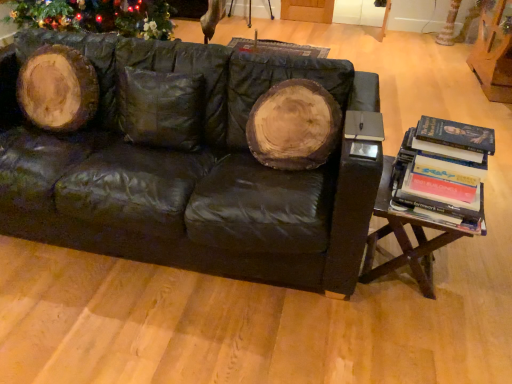
Image resolution: width=512 pixels, height=384 pixels. What are the coordinates of `free point above hardcover books at right (from a real-world perspective)` in the screenshot? It's located at (452, 132).